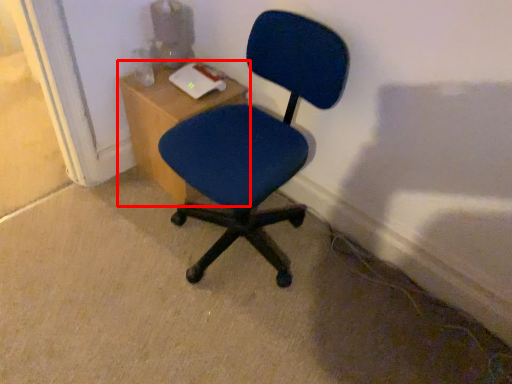
Question: From the image's perspective, where is table (annotated by the red box) located in relation to chair in the image?

Choices:
 (A) above
 (B) below

Answer: (A)